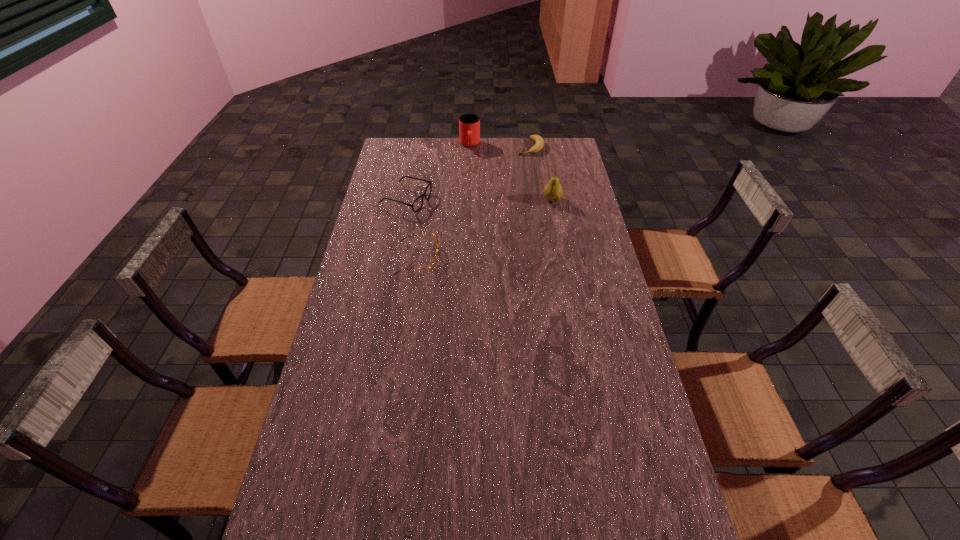
The width and height of the screenshot is (960, 540). I want to click on vacant space on the desktop that is between the nearer spectacles and the pear and is positioned on the front-facing side of the farther spectacles, so click(499, 223).

I want to click on free space on the desktop that is between the nearest object and the pear and is positioned on the handle side of the third object from right to left, so click(477, 233).

Image resolution: width=960 pixels, height=540 pixels. I want to click on vacant space on the desktop that is between the nearest object and the pear and is positioned at the stem of the shortest object, so click(x=491, y=227).